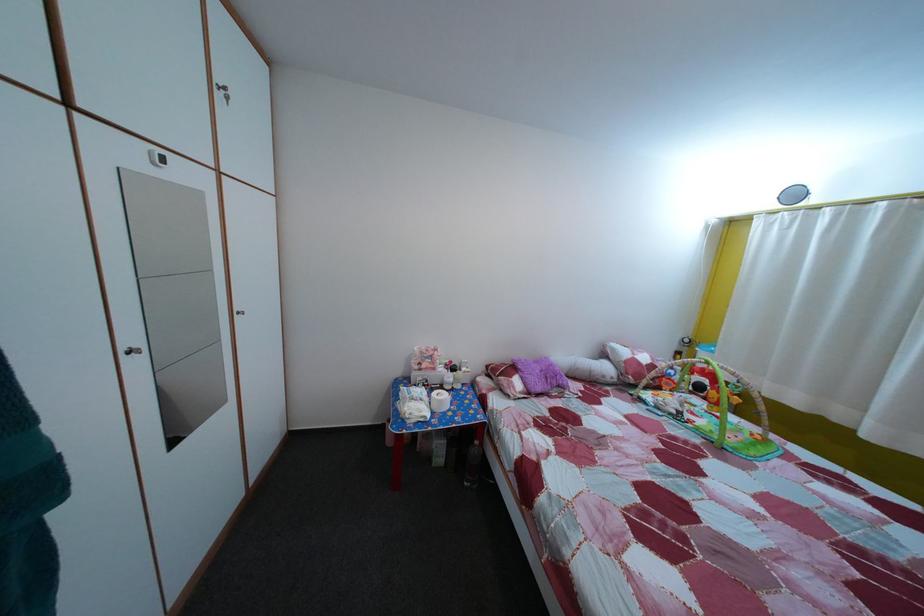
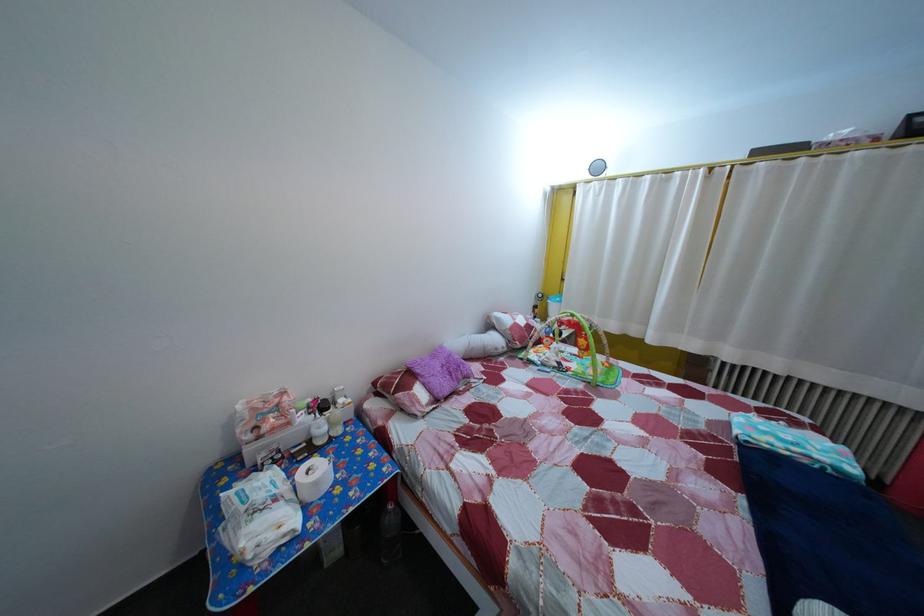
Find the pixel in the second image that matches (x=531, y=386) in the first image.

(433, 392)